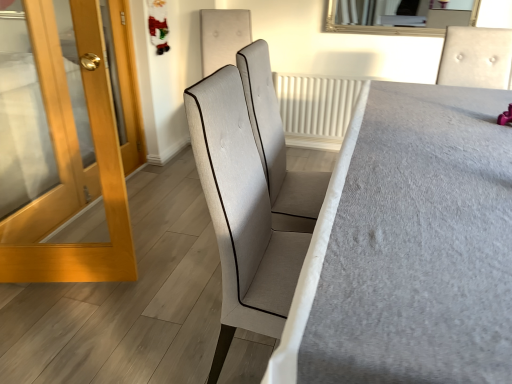
Where is `empty space that is to the right of wooden glossy door at left`? empty space that is to the right of wooden glossy door at left is located at coordinates (154, 299).